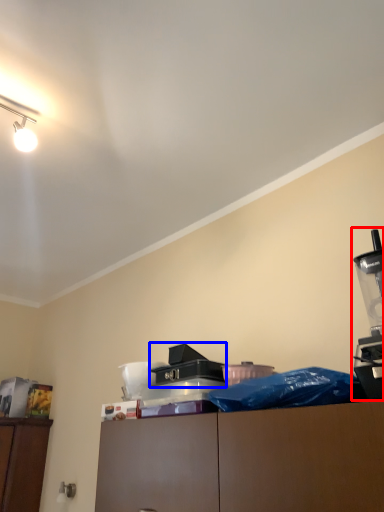
Question: Which object is further to the camera taking this photo, coffee machine (highlighted by a red box) or job (highlighted by a blue box)?

Choices:
 (A) coffee machine
 (B) job

Answer: (B)